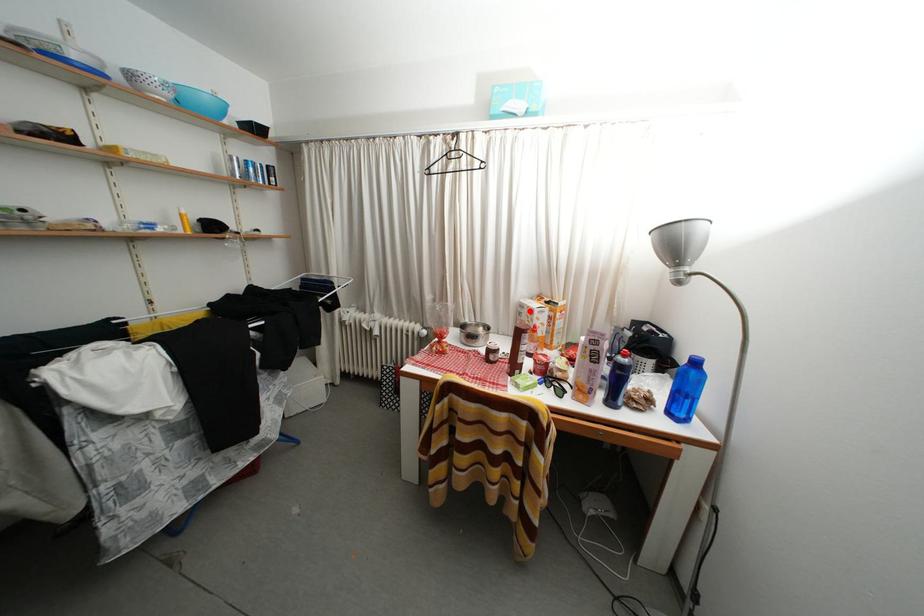
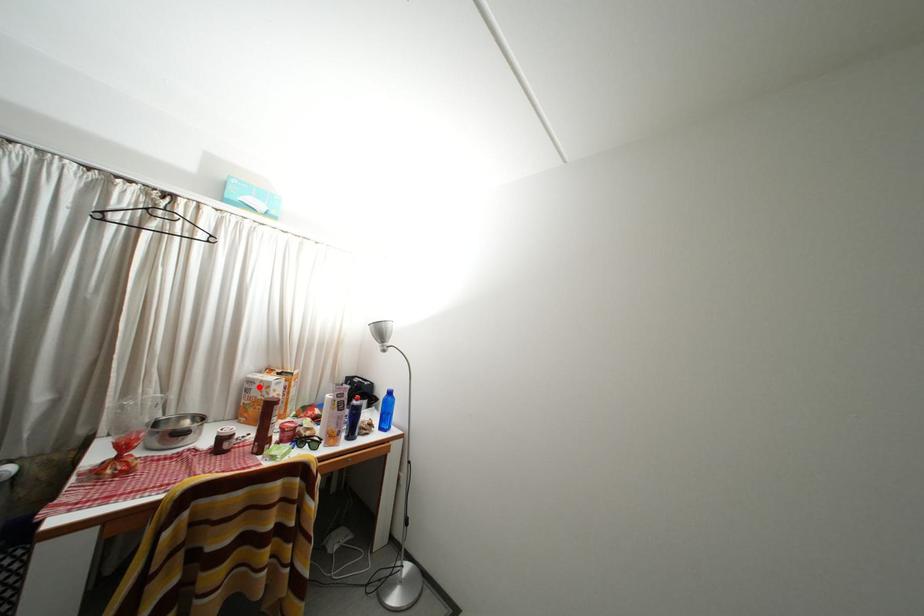
I am providing you with two images of the same scene from different viewpoints. A red point is marked on the first image and another point is marked on the second image. Do the highlighted points in image1 and image2 indicate the same real-world spot?

Yes